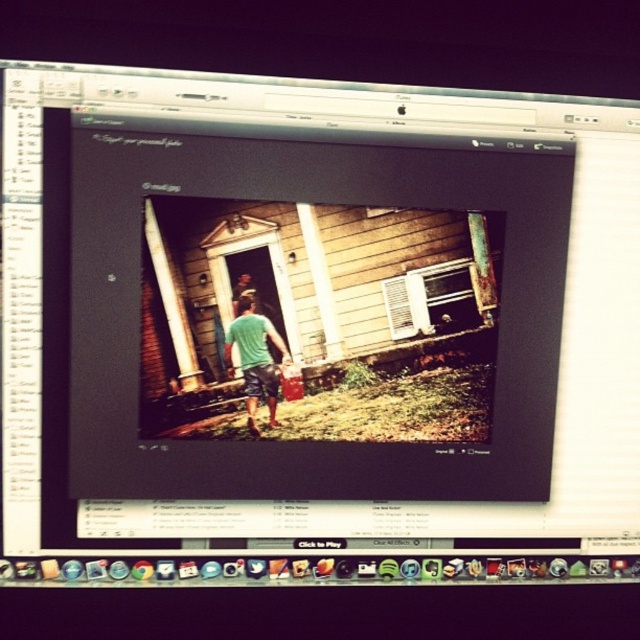
Question: Which of the following is the closest to the observer?

Choices:
 (A) (124, 476)
 (B) (266, 330)

Answer: (A)

Question: Does matte black monitor at center appear over green cotton shirt at center?

Choices:
 (A) no
 (B) yes

Answer: (B)

Question: Can you confirm if matte black monitor at center is positioned to the left of green cotton shirt at center?

Choices:
 (A) yes
 (B) no

Answer: (B)

Question: Which point is closer to the camera?

Choices:
 (A) (228, 323)
 (B) (268, 317)

Answer: (A)

Question: Can you confirm if matte black monitor at center is positioned to the right of green cotton shirt at center?

Choices:
 (A) no
 (B) yes

Answer: (B)